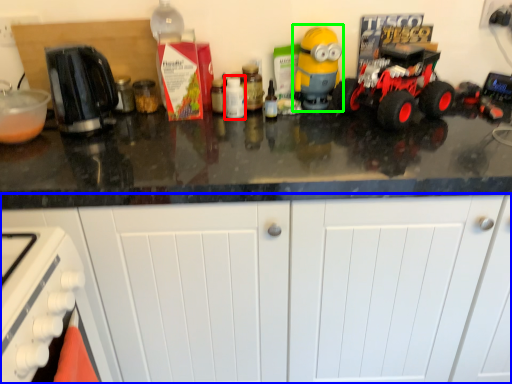
Question: Estimate the real-world distances between objects in this image. Which object is closer to bottle (highlighted by a red box), cabinetry (highlighted by a blue box) or toy (highlighted by a green box)?

Choices:
 (A) cabinetry
 (B) toy

Answer: (B)